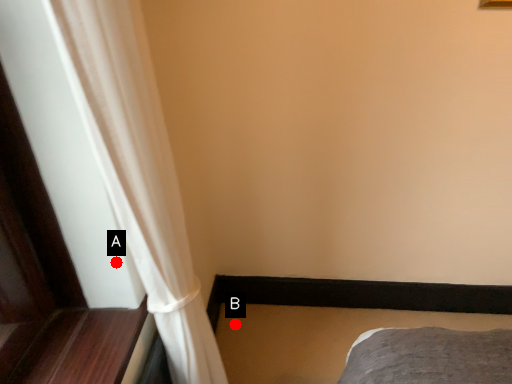
Question: Two points are circled on the image, labeled by A and B beside each circle. Which point appears farthest from the camera in this image?

Choices:
 (A) A is further
 (B) B is further

Answer: (B)